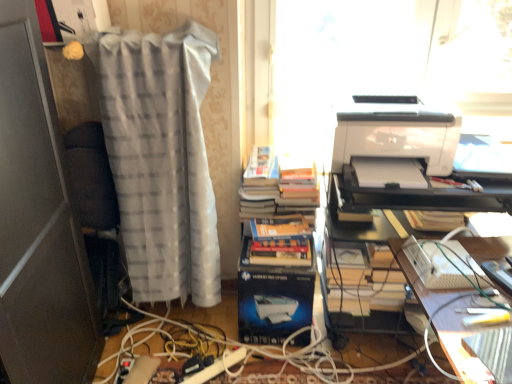
Identify the location of free location to the left of metallic silver remote control at lower right, which appears as the 1th equipment when viewed from the right. (465, 297).